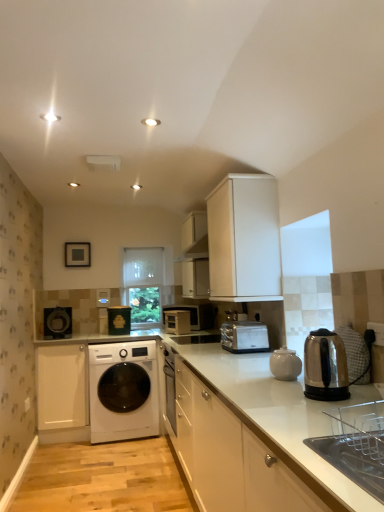
I want to click on blank space to the left of stainless steel kettle at right, which appears as the second home appliance when viewed from the back, so click(273, 402).